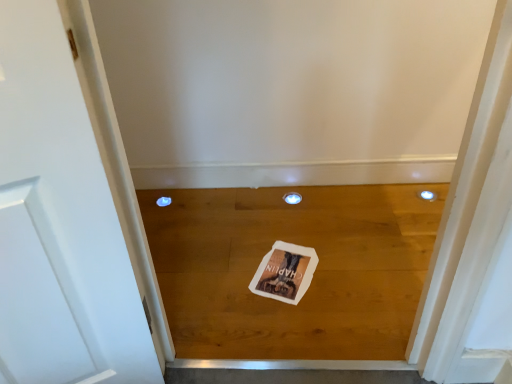
I want to click on free spot to the right of white paper postcard at center, so click(344, 266).